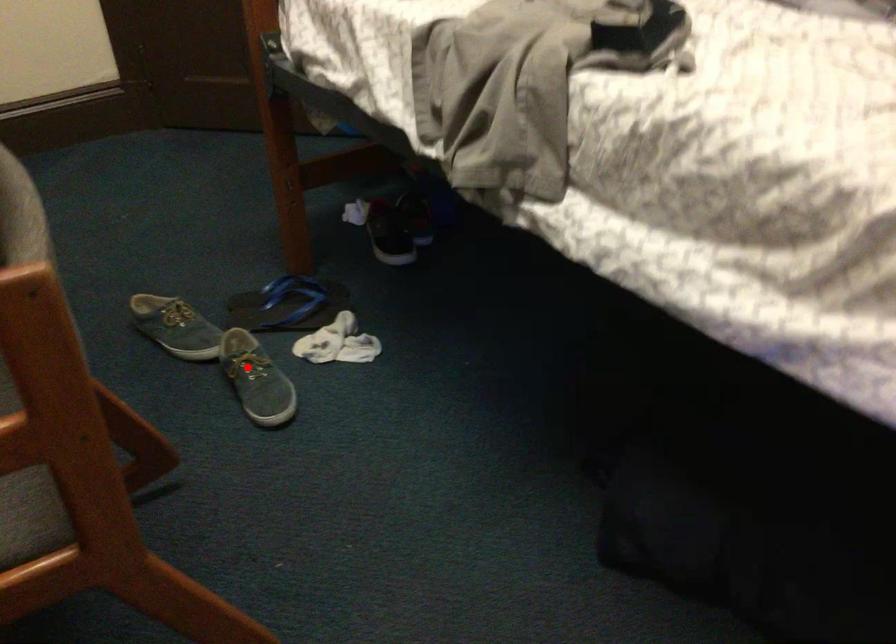
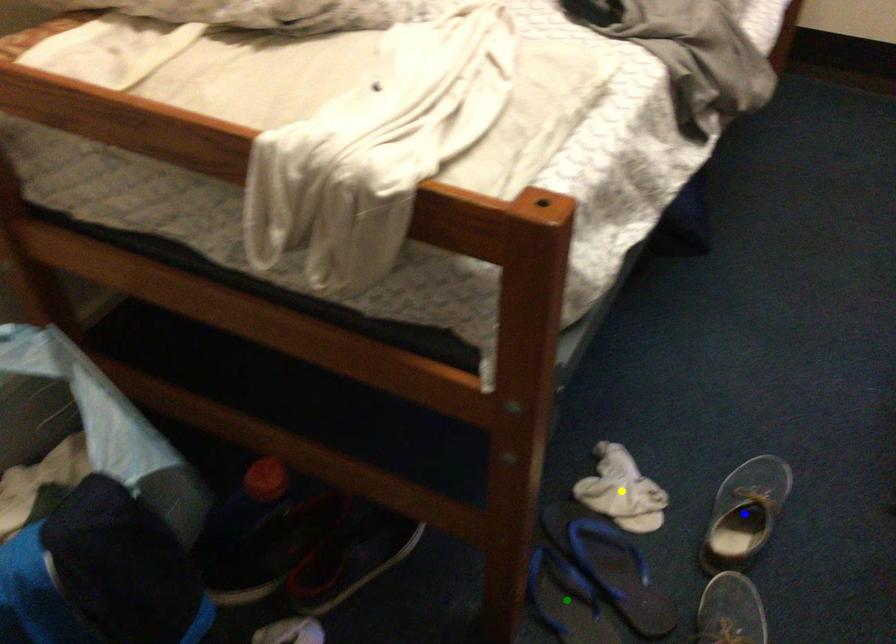
Question: I am providing you with two images of the same scene from different viewpoints. A red point is marked on the first image. You are given multiple points on the second image. Can you choose the point in image 2 that corresponds to the point in image 1?

Choices:
 (A) yellow point
 (B) green point
 (C) blue point

Answer: (C)